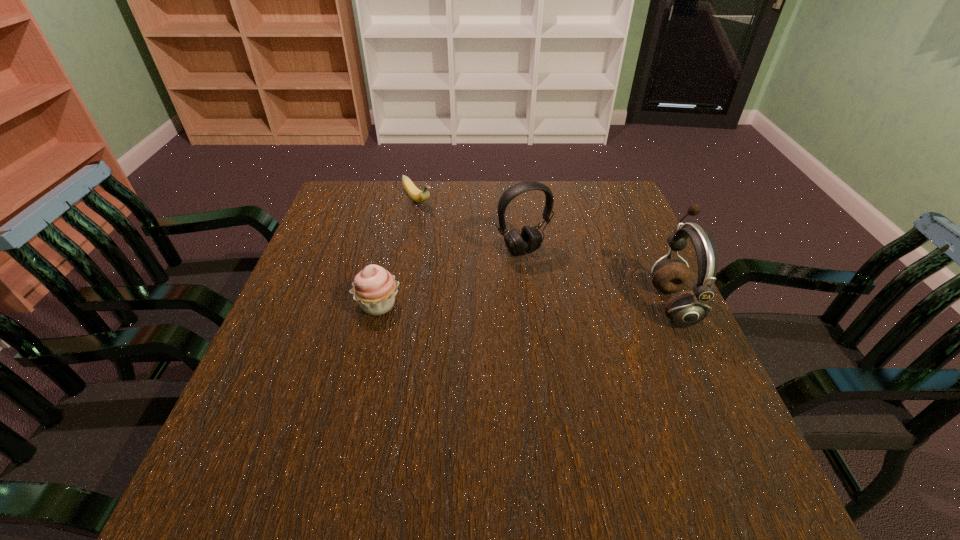
You are a GUI agent. You are given a task and a screenshot of the screen. Output one action in this format:
    pyautogui.click(x=<x>, y=<y>)
    Task: Click on the free space that satisfies the following two spatial constraints: 1. on the back side of the cupcake; 2. on the ear pads of the earphone
    The image size is (960, 540).
    Given the screenshot: What is the action you would take?
    pyautogui.click(x=378, y=304)